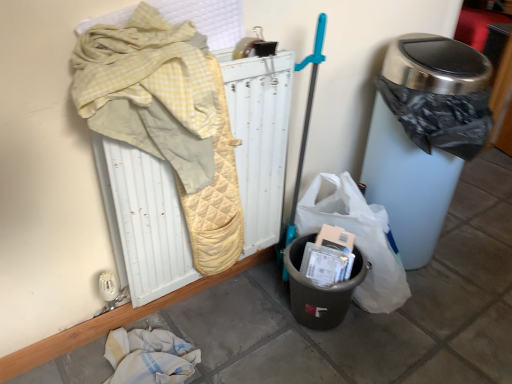
Question: Is there a large distance between metallic trash can at right and black plastic recycling bin at lower center?

Choices:
 (A) yes
 (B) no

Answer: (B)

Question: Is metallic trash can at right positioned beyond the bounds of black plastic recycling bin at lower center?

Choices:
 (A) yes
 (B) no

Answer: (A)

Question: Is metallic trash can at right closer to camera compared to black plastic recycling bin at lower center?

Choices:
 (A) yes
 (B) no

Answer: (A)

Question: Would you say black plastic recycling bin at lower center is part of metallic trash can at right's contents?

Choices:
 (A) no
 (B) yes

Answer: (A)

Question: Considering the relative sizes of metallic trash can at right and black plastic recycling bin at lower center in the image provided, is metallic trash can at right bigger than black plastic recycling bin at lower center?

Choices:
 (A) yes
 (B) no

Answer: (A)

Question: Which is correct: black plastic recycling bin at lower center is inside metallic trash can at right, or outside of it?

Choices:
 (A) outside
 (B) inside

Answer: (A)

Question: From the image's perspective, is black plastic recycling bin at lower center positioned above or below metallic trash can at right?

Choices:
 (A) below
 (B) above

Answer: (A)

Question: Considering the positions of black plastic recycling bin at lower center and metallic trash can at right in the image, is black plastic recycling bin at lower center taller or shorter than metallic trash can at right?

Choices:
 (A) tall
 (B) short

Answer: (B)

Question: Looking at the image, does black plastic recycling bin at lower center seem bigger or smaller compared to metallic trash can at right?

Choices:
 (A) big
 (B) small

Answer: (B)

Question: From the image's perspective, is yellow quilted radiator at upper left positioned above or below metallic trash can at right?

Choices:
 (A) below
 (B) above

Answer: (A)

Question: Is yellow quilted radiator at upper left in front of or behind metallic trash can at right in the image?

Choices:
 (A) front
 (B) behind

Answer: (A)

Question: In terms of height, does yellow quilted radiator at upper left look taller or shorter compared to metallic trash can at right?

Choices:
 (A) tall
 (B) short

Answer: (B)

Question: From a real-world perspective, relative to metallic trash can at right, is yellow quilted radiator at upper left vertically above or below?

Choices:
 (A) below
 (B) above

Answer: (B)

Question: In terms of width, does metallic trash can at right look wider or thinner when compared to black plastic recycling bin at lower center?

Choices:
 (A) thin
 (B) wide

Answer: (B)

Question: From a real-world perspective, is metallic trash can at right physically located above or below black plastic recycling bin at lower center?

Choices:
 (A) below
 (B) above

Answer: (B)